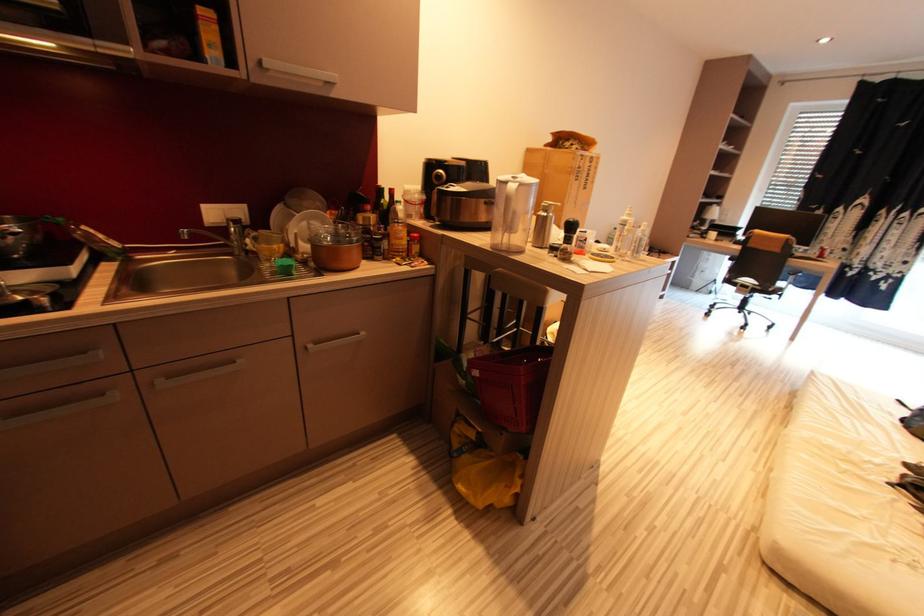
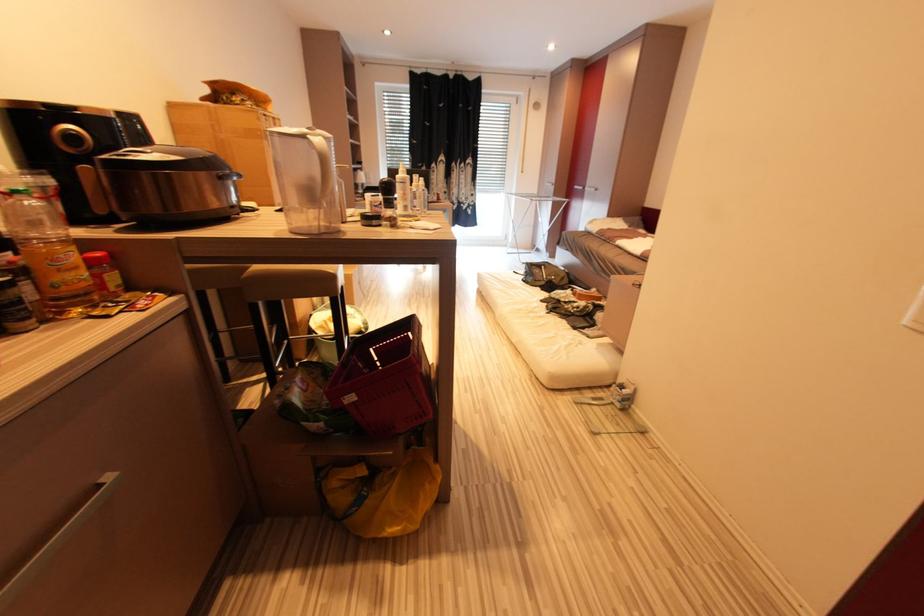
Question: How did the camera likely rotate?

Choices:
 (A) Left
 (B) Right
 (C) Up
 (D) Down

Answer: (B)